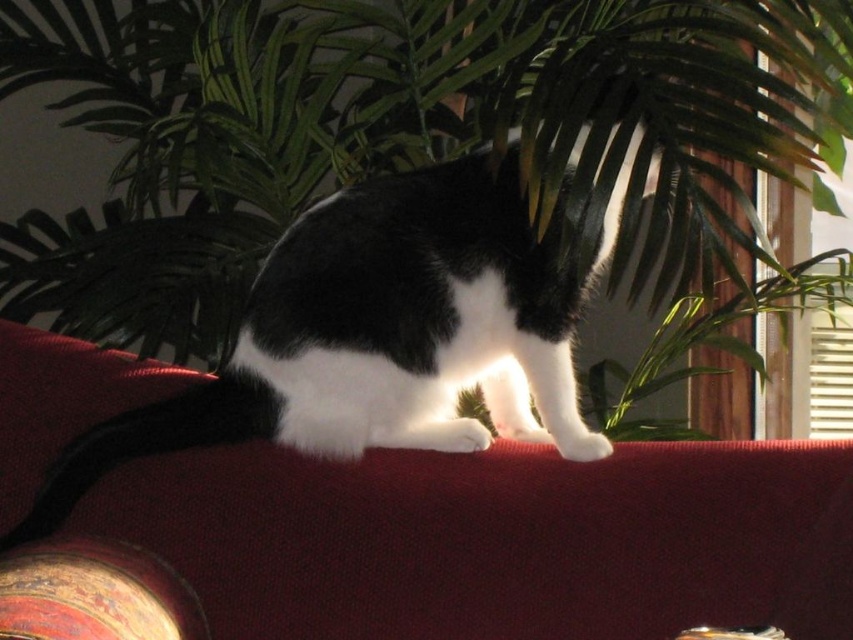
Who is positioned more to the left, green leafy plant at upper center or burgundy fabric couch at upper center?

green leafy plant at upper center

Between point (766, 259) and point (560, 602), which one is positioned in front?

Point (560, 602) is in front.

Locate an element on the screen. This screenshot has height=640, width=853. green leafy plant at upper center is located at coordinates (407, 138).

Who is higher up, burgundy fabric couch at upper center or black/white fur cat at center?

black/white fur cat at center

What do you see at coordinates (497, 540) in the screenshot?
I see `burgundy fabric couch at upper center` at bounding box center [497, 540].

Who is more forward, (583,600) or (524,406)?

Point (583,600) is more forward.

Locate an element on the screen. The height and width of the screenshot is (640, 853). burgundy fabric couch at upper center is located at coordinates (497, 540).

How much distance is there between green leafy plant at upper center and black/white fur cat at center?

38.82 centimeters

Does green leafy plant at upper center lie behind black/white fur cat at center?

Yes, green leafy plant at upper center is behind black/white fur cat at center.

Who is more distant from viewer, (177, 257) or (339, 435)?

The point (177, 257) is more distant.

Where is `green leafy plant at upper center`? This screenshot has width=853, height=640. green leafy plant at upper center is located at coordinates (407, 138).